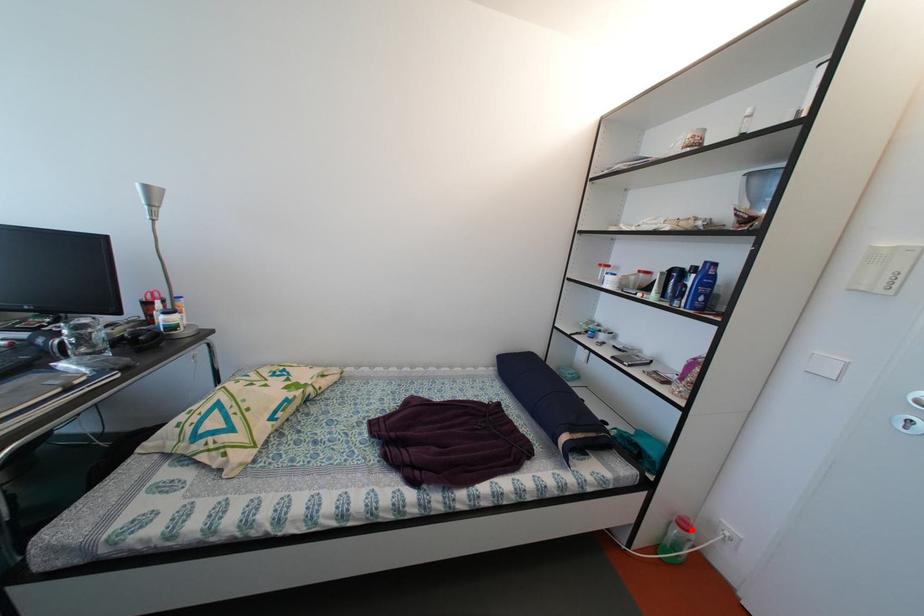
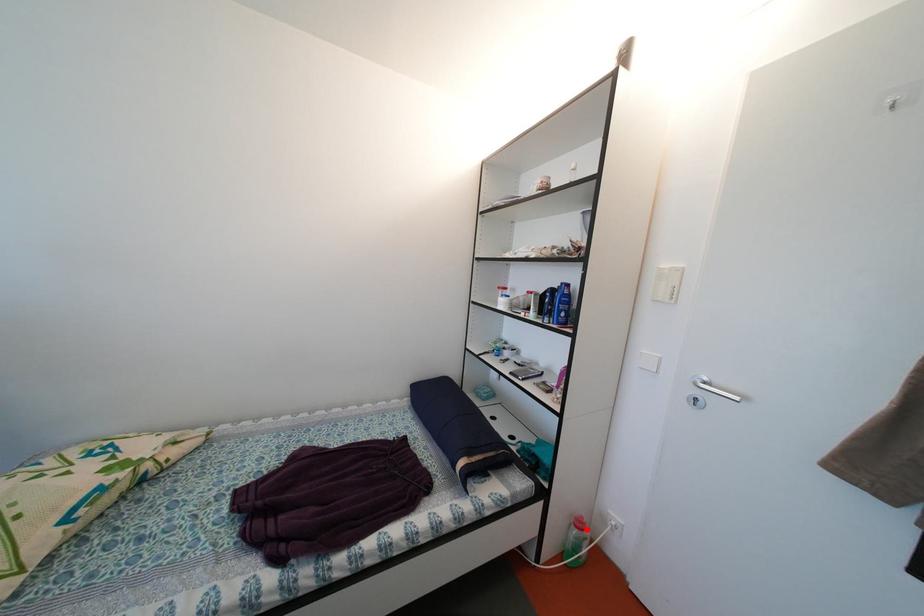
I am providing you with two images of the same scene from different viewpoints. A red point is marked on the first image and another point is marked on the second image. Are the points marked in image1 and image2 representing the same 3D position?

Yes